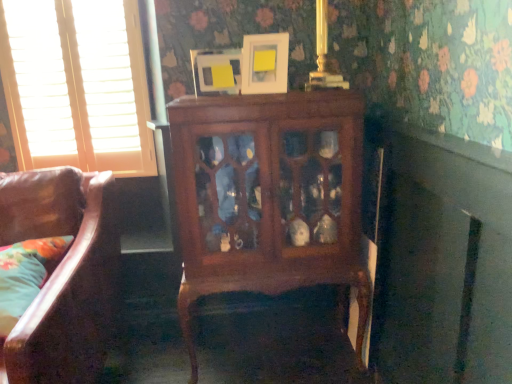
Question: Does matte white picture frame at upper center, which appears as the 1th picture frame when viewed from the left, have a smaller size compared to fluffy fabric pillow at lower left?

Choices:
 (A) no
 (B) yes

Answer: (B)

Question: Is matte white picture frame at upper center, positioned as the 2th picture frame in right-to-left order, aimed at fluffy fabric pillow at lower left?

Choices:
 (A) no
 (B) yes

Answer: (A)

Question: From a real-world perspective, is matte white picture frame at upper center, positioned as the 2th picture frame in right-to-left order, on top of fluffy fabric pillow at lower left?

Choices:
 (A) yes
 (B) no

Answer: (A)

Question: Is matte white picture frame at upper center, positioned as the 2th picture frame in right-to-left order, to the right of fluffy fabric pillow at lower left from the viewer's perspective?

Choices:
 (A) no
 (B) yes

Answer: (B)

Question: Would you consider matte white picture frame at upper center, positioned as the 2th picture frame in right-to-left order, to be distant from fluffy fabric pillow at lower left?

Choices:
 (A) no
 (B) yes

Answer: (A)

Question: Does matte white picture frame at upper center, which appears as the 1th picture frame when viewed from the left, have a larger size compared to fluffy fabric pillow at lower left?

Choices:
 (A) no
 (B) yes

Answer: (A)

Question: Can you confirm if white matte picture frame at upper center, which ranks as the 1th picture frame in right-to-left order, is positioned to the left of white wood blinds at left?

Choices:
 (A) yes
 (B) no

Answer: (B)

Question: Can you confirm if white matte picture frame at upper center, acting as the 2th picture frame starting from the left, is shorter than white wood blinds at left?

Choices:
 (A) yes
 (B) no

Answer: (A)

Question: From a real-world perspective, is white matte picture frame at upper center, acting as the 2th picture frame starting from the left, on top of white wood blinds at left?

Choices:
 (A) no
 (B) yes

Answer: (B)

Question: Can you confirm if white matte picture frame at upper center, which ranks as the 1th picture frame in right-to-left order, is positioned to the right of white wood blinds at left?

Choices:
 (A) no
 (B) yes

Answer: (B)

Question: Is white matte picture frame at upper center, acting as the 2th picture frame starting from the left, positioned with its back to white wood blinds at left?

Choices:
 (A) yes
 (B) no

Answer: (B)

Question: Considering the relative sizes of white matte picture frame at upper center, which ranks as the 1th picture frame in right-to-left order, and white wood blinds at left in the image provided, is white matte picture frame at upper center, which ranks as the 1th picture frame in right-to-left order, taller than white wood blinds at left?

Choices:
 (A) no
 (B) yes

Answer: (A)

Question: Is mahogany cabinet at center wider than fluffy fabric pillow at lower left?

Choices:
 (A) no
 (B) yes

Answer: (A)